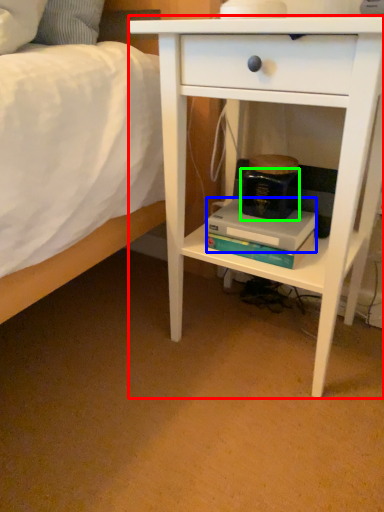
Question: Which is farther away from nightstand (highlighted by a red box)? paperback book (highlighted by a blue box) or paperback book (highlighted by a green box)?

Choices:
 (A) paperback book
 (B) paperback book

Answer: (B)